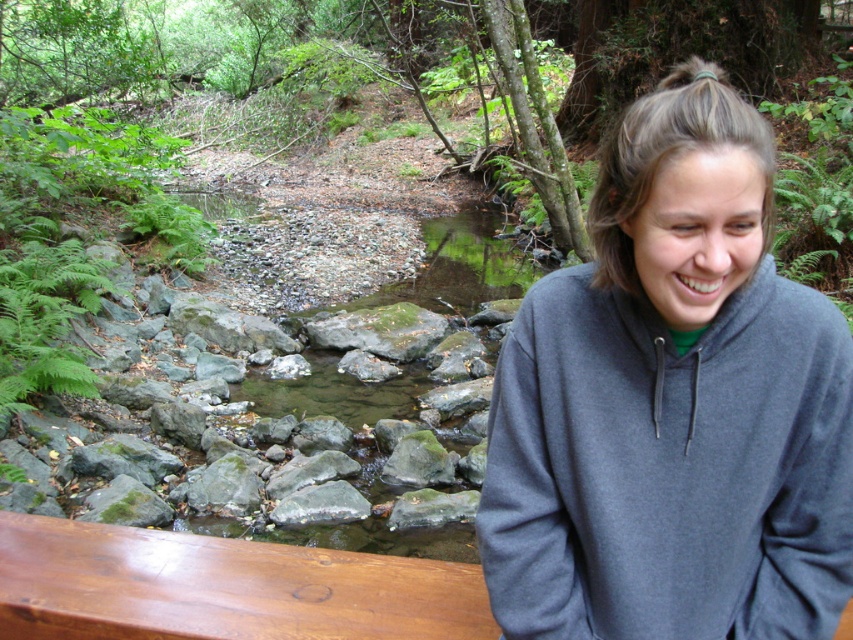
Question: Can you confirm if gray fleece sweatshirt at center is positioned to the left of gray smooth rock at center?

Choices:
 (A) no
 (B) yes

Answer: (A)

Question: Is gray fleece sweatshirt at center above shiny brown wood at lower left?

Choices:
 (A) no
 (B) yes

Answer: (B)

Question: Which object is positioned closest to the gray fleece sweatshirt at center?

Choices:
 (A) shiny brown wood at lower left
 (B) gray smooth rock at center

Answer: (A)

Question: Can you confirm if gray fleece sweatshirt at center is thinner than shiny brown wood at lower left?

Choices:
 (A) yes
 (B) no

Answer: (A)

Question: Which point is farther to the camera?

Choices:
 (A) (306, 506)
 (B) (730, 605)
 (C) (30, 557)

Answer: (A)

Question: Estimate the real-world distances between objects in this image. Which object is closer to the shiny brown wood at lower left?

Choices:
 (A) gray smooth rock at center
 (B) gray fleece sweatshirt at center

Answer: (B)